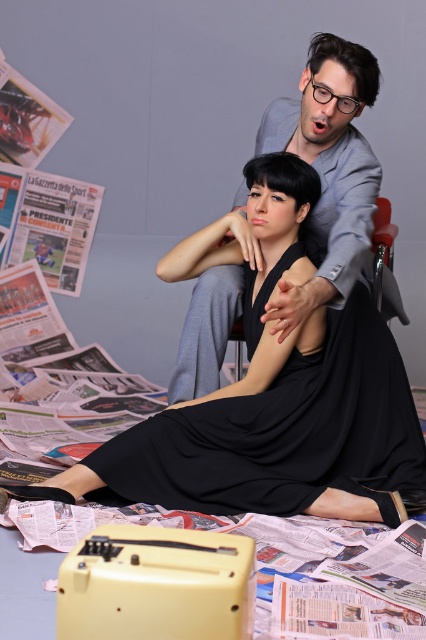
Is black satin dress at center smaller than gray suit at center?

Indeed, black satin dress at center has a smaller size compared to gray suit at center.

Which is below, black satin dress at center or gray suit at center?

black satin dress at center is lower down.

This screenshot has height=640, width=426. What are the coordinates of `black satin dress at center` in the screenshot? It's located at point(282,432).